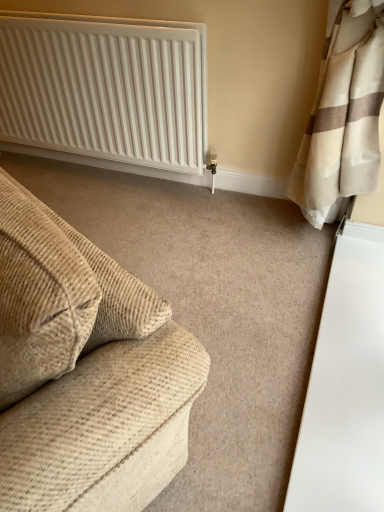
Question: From a real-world perspective, is beige corduroy couch at left positioned above or below white ribbed radiator at upper left?

Choices:
 (A) above
 (B) below

Answer: (A)

Question: In terms of height, does beige corduroy couch at left look taller or shorter compared to white ribbed radiator at upper left?

Choices:
 (A) short
 (B) tall

Answer: (A)

Question: Is point (139, 503) closer or farther from the camera than point (87, 81)?

Choices:
 (A) farther
 (B) closer

Answer: (B)

Question: From the image's perspective, relative to beige corduroy couch at left, is white ribbed radiator at upper left above or below?

Choices:
 (A) above
 (B) below

Answer: (A)

Question: Considering their positions, is white ribbed radiator at upper left located in front of or behind beige corduroy couch at left?

Choices:
 (A) front
 (B) behind

Answer: (B)

Question: Is white ribbed radiator at upper left taller or shorter than beige corduroy couch at left?

Choices:
 (A) tall
 (B) short

Answer: (A)

Question: From a real-world perspective, is white ribbed radiator at upper left positioned above or below beige corduroy couch at left?

Choices:
 (A) below
 (B) above

Answer: (A)